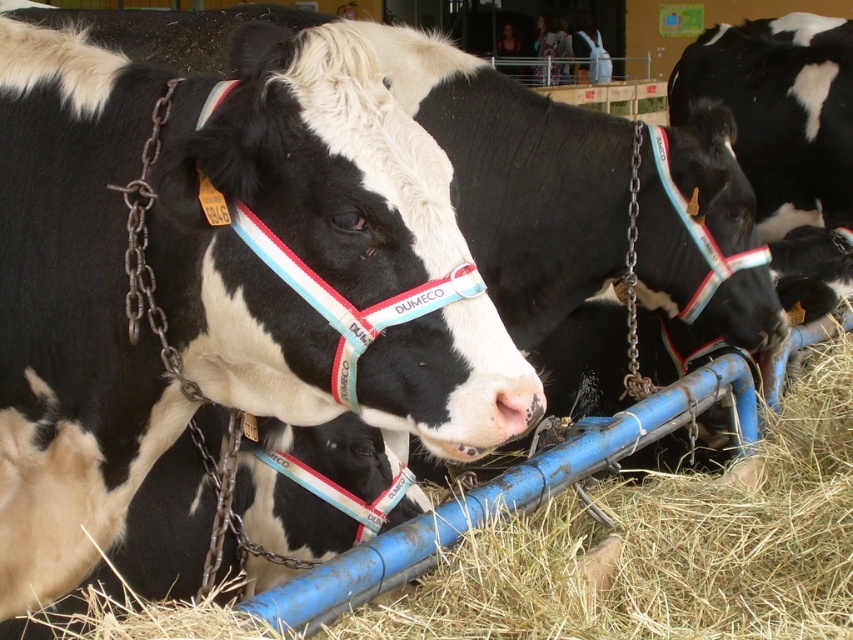
Question: Which object appears closest to the camera in this image?

Choices:
 (A) metallic chain at center
 (B) metallic chain at left

Answer: (B)

Question: Does metallic chain at left have a greater width compared to metallic chain at center?

Choices:
 (A) yes
 (B) no

Answer: (A)

Question: Does metallic chain at left appear over metallic chain at center?

Choices:
 (A) no
 (B) yes

Answer: (A)

Question: Does metallic chain at left have a smaller size compared to metallic chain at center?

Choices:
 (A) yes
 (B) no

Answer: (B)

Question: Which point is farther to the camera?

Choices:
 (A) (631, 372)
 (B) (202, 177)

Answer: (A)

Question: Which object is farther from the camera taking this photo?

Choices:
 (A) metallic chain at center
 (B) metallic chain at left

Answer: (A)